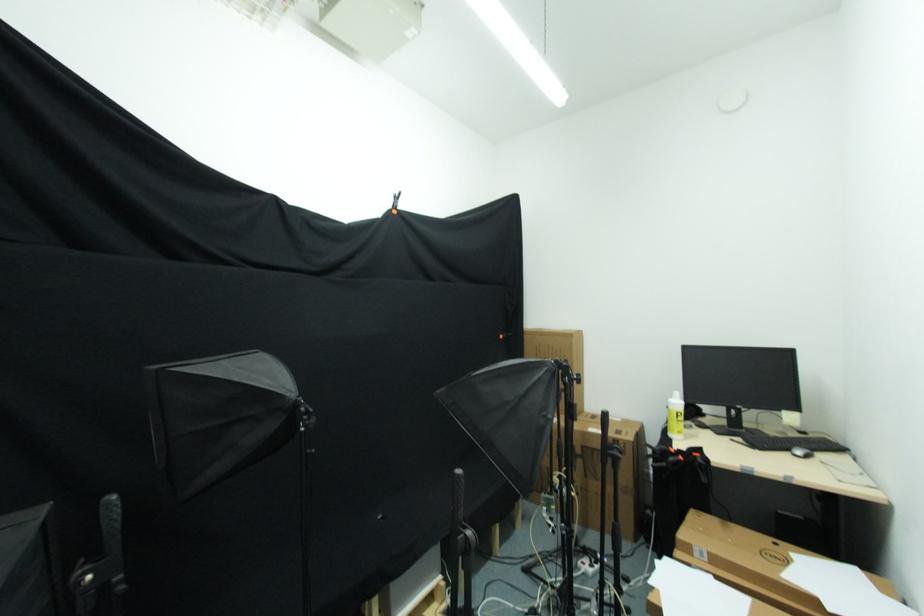
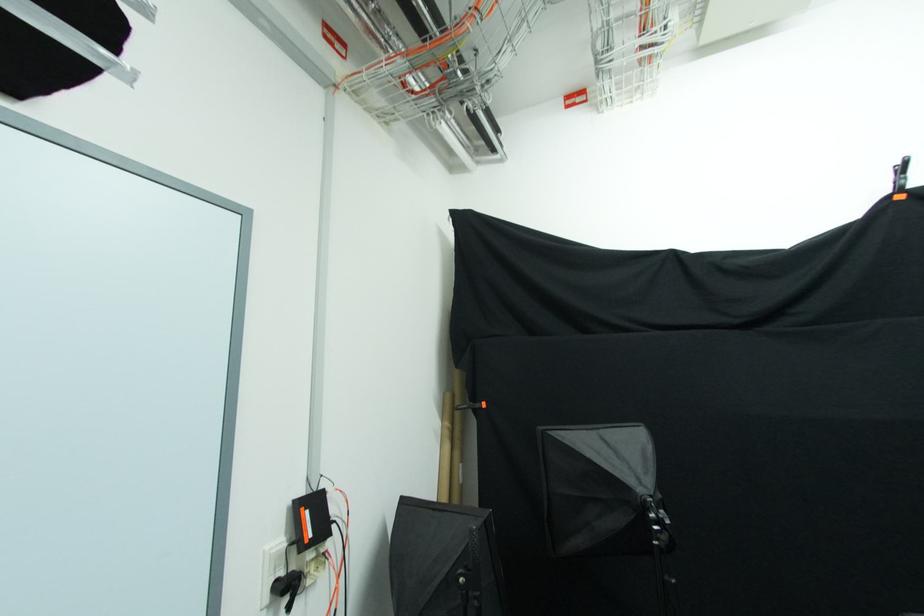
Find the pixel in the second image that matches (x=399, y=206) in the first image.

(904, 180)